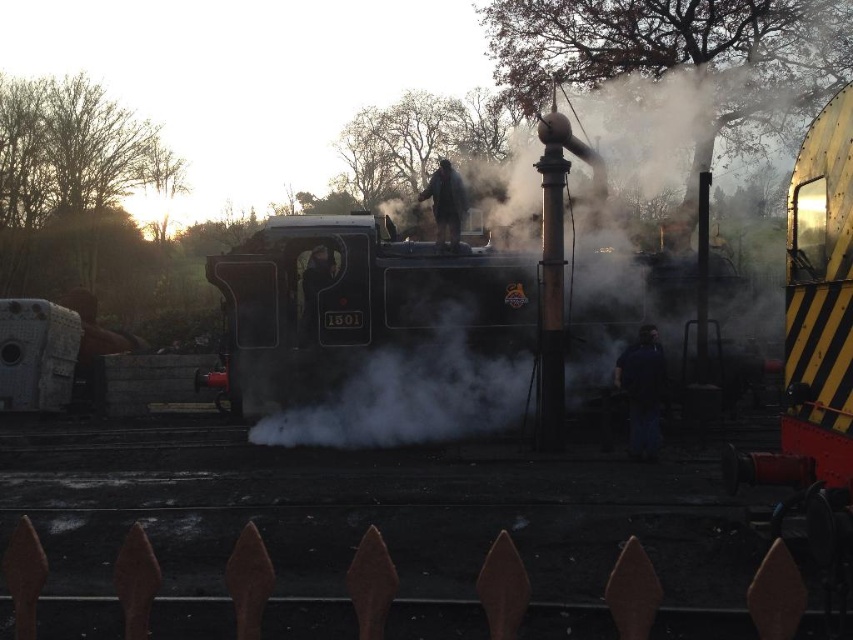
Question: Can you confirm if dark blue fabric at center is smaller than dark gray fabric jacket at center?

Choices:
 (A) no
 (B) yes

Answer: (B)

Question: Does dark blue fabric at center have a lesser width compared to dark fabric jacket at center?

Choices:
 (A) no
 (B) yes

Answer: (A)

Question: Among these objects, which one is nearest to the camera?

Choices:
 (A) dark blue fabric at center
 (B) dark gray fabric jacket at center
 (C) dark fabric jacket at center

Answer: (A)

Question: Which object appears farthest from the camera in this image?

Choices:
 (A) dark gray fabric jacket at center
 (B) dark fabric jacket at center

Answer: (A)

Question: Among these objects, which one is nearest to the camera?

Choices:
 (A) dark blue fabric at center
 (B) dark gray fabric jacket at center
 (C) dark fabric jacket at center

Answer: (A)

Question: Can you confirm if dark blue fabric at center is positioned to the left of dark gray fabric jacket at center?

Choices:
 (A) yes
 (B) no

Answer: (B)